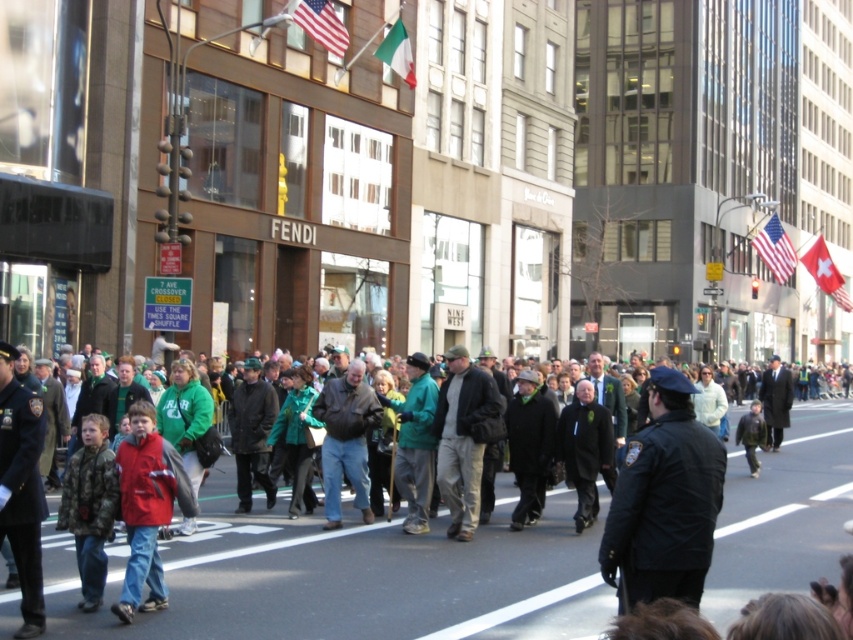
Is camouflage jacket at lower left taller than dark gray suit at center?

Incorrect, camouflage jacket at lower left's height is not larger of dark gray suit at center's.

Consider the image. How distant is camouflage jacket at lower left from dark gray suit at center?

They are 15.40 meters apart.

Does point (97, 442) lie in front of point (788, 378)?

Yes, it is in front of point (788, 378).

At what (x,y) coordinates should I click in order to perform the action: click on camouflage jacket at lower left. Please return your answer as a coordinate pair (x, y). The image size is (853, 640). Looking at the image, I should click on (90, 506).

Between dark blue uniform at left and dark brown leather jacket at center, which one is positioned higher?

dark blue uniform at left is higher up.

Locate an element on the screen. dark blue uniform at left is located at coordinates (21, 486).

You are a GUI agent. You are given a task and a screenshot of the screen. Output one action in this format:
    pyautogui.click(x=<x>, y=<y>)
    Task: Click on the dark blue uniform at left
    
    Given the screenshot: What is the action you would take?
    pyautogui.click(x=21, y=486)

Is dark blue uniform at left taller than american flag at upper center?

Indeed, dark blue uniform at left has a greater height compared to american flag at upper center.

Is dark blue uniform at left to the left of american flag at upper center from the viewer's perspective?

Incorrect, dark blue uniform at left is not on the left side of american flag at upper center.

Who is more forward, (x=35, y=634) or (x=312, y=1)?

Point (x=35, y=634) is more forward.

Where is `dark blue uniform at left`? The width and height of the screenshot is (853, 640). dark blue uniform at left is located at coordinates (21, 486).